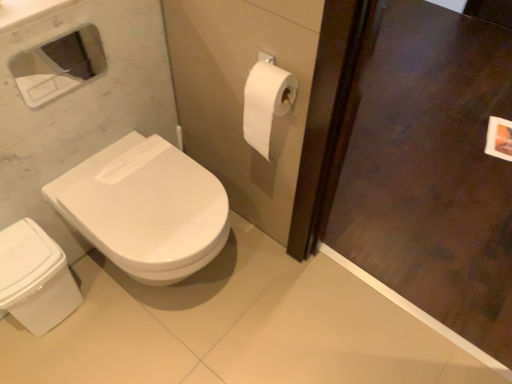
This screenshot has width=512, height=384. I want to click on white glossy medicine cabinet at upper left, so click(58, 66).

Image resolution: width=512 pixels, height=384 pixels. Identify the location of dark wood screen door at right. (432, 170).

Find the location of `white glossy medicine cabinet at upper left`. white glossy medicine cabinet at upper left is located at coordinates (58, 66).

Is dark wood screen door at right at the back of white glossy bidet at lower left?

white glossy bidet at lower left does not have its back to dark wood screen door at right.

At what (x,y) coordinates should I click in order to perform the action: click on screen door that appears on the right of white glossy bidet at lower left. Please return your answer as a coordinate pair (x, y). This screenshot has height=384, width=512. Looking at the image, I should click on (432, 170).

Is white glossy bidet at lower left in front of or behind dark wood screen door at right in the image?

white glossy bidet at lower left is behind dark wood screen door at right.

How much distance is there between dark wood screen door at right and white glossy toilet at lower left?

dark wood screen door at right and white glossy toilet at lower left are 1.06 meters apart from each other.

From a real-world perspective, does dark wood screen door at right sit lower than white glossy toilet at lower left?

Actually, dark wood screen door at right is physically above white glossy toilet at lower left in the real world.

This screenshot has height=384, width=512. Identify the location of screen door that appears on the right of white glossy toilet at lower left. (432, 170).

Considering the points (496, 359) and (95, 181), which point is behind, point (496, 359) or point (95, 181)?

The point (496, 359) is more distant.

Is white glossy medicine cabinet at upper left oriented away from dark wood screen door at right?

No.

Considering the sizes of objects white glossy medicine cabinet at upper left and dark wood screen door at right in the image provided, who is thinner, white glossy medicine cabinet at upper left or dark wood screen door at right?

white glossy medicine cabinet at upper left is thinner.

Is white glossy medicine cabinet at upper left further to the viewer compared to dark wood screen door at right?

Yes, it is.

Which is behind, point (31, 79) or point (7, 287)?

The point (31, 79) is farther.

From a real-world perspective, which is physically above, white glossy medicine cabinet at upper left or white glossy bidet at lower left?

white glossy medicine cabinet at upper left, from a real-world perspective.

Considering the sizes of white glossy medicine cabinet at upper left and white glossy bidet at lower left in the image, is white glossy medicine cabinet at upper left bigger or smaller than white glossy bidet at lower left?

Considering their sizes, white glossy medicine cabinet at upper left takes up less space than white glossy bidet at lower left.

Is white glossy bidet at lower left facing away from white glossy medicine cabinet at upper left?

No.

From their relative heights in the image, would you say white glossy bidet at lower left is taller or shorter than white glossy medicine cabinet at upper left?

Clearly, white glossy bidet at lower left is taller compared to white glossy medicine cabinet at upper left.

What's the angular difference between white glossy bidet at lower left and white glossy medicine cabinet at upper left's facing directions?

0.175 degrees separate the facing orientations of white glossy bidet at lower left and white glossy medicine cabinet at upper left.

Is white glossy toilet at lower left facing towards dark wood screen door at right?

No.

From the image's perspective, which object appears higher, white glossy toilet at lower left or dark wood screen door at right?

dark wood screen door at right, from the image's perspective.

Between white glossy toilet at lower left and dark wood screen door at right, which one has less height?

With less height is white glossy toilet at lower left.

The height and width of the screenshot is (384, 512). In order to click on screen door on the right of white glossy toilet at lower left in this screenshot , I will do `click(432, 170)`.

From a real-world perspective, which object stands above the other?

white glossy toilet at lower left, from a real-world perspective.

In terms of width, does white glossy bidet at lower left look wider or thinner when compared to white glossy toilet at lower left?

Clearly, white glossy bidet at lower left has less width compared to white glossy toilet at lower left.

Consider the image. Which is farther from the camera, (52,260) or (197,182)?

Point (52,260)

Between white glossy bidet at lower left and white glossy toilet at lower left, which one has larger size?

With larger size is white glossy toilet at lower left.

You are a GUI agent. You are given a task and a screenshot of the screen. Output one action in this format:
    pyautogui.click(x=<x>, y=<y>)
    Task: Click on the bidet lying behind the dark wood screen door at right
    This screenshot has width=512, height=384.
    Given the screenshot: What is the action you would take?
    pyautogui.click(x=35, y=278)

At what (x,y) coordinates should I click in order to perform the action: click on toilet on the left of the dark wood screen door at right. Please return your answer as a coordinate pair (x, y). Looking at the image, I should click on (145, 208).

Which object lies nearer to the anchor point white glossy bidet at lower left, dark wood screen door at right or white glossy toilet at lower left?

The object closer to white glossy bidet at lower left is white glossy toilet at lower left.

Looking at the image, which one is located closer to dark wood screen door at right, white glossy toilet at lower left or white glossy medicine cabinet at upper left?

The object closer to dark wood screen door at right is white glossy toilet at lower left.

From the picture: Looking at the image, which one is located closer to white glossy medicine cabinet at upper left, white glossy bidet at lower left or white glossy toilet at lower left?

white glossy toilet at lower left is positioned closer to the anchor white glossy medicine cabinet at upper left.

From the image, which object appears to be nearer to dark wood screen door at right, white glossy toilet at lower left or white glossy bidet at lower left?

The object closer to dark wood screen door at right is white glossy toilet at lower left.

Considering their positions, is dark wood screen door at right positioned further to white glossy bidet at lower left than white glossy medicine cabinet at upper left?

dark wood screen door at right is further to white glossy bidet at lower left.

Considering their positions, is white glossy medicine cabinet at upper left positioned closer to white glossy toilet at lower left than dark wood screen door at right?

dark wood screen door at right.

Looking at the image, which one is located further to dark wood screen door at right, white glossy bidet at lower left or white glossy toilet at lower left?

Based on the image, white glossy bidet at lower left appears to be further to dark wood screen door at right.

Estimate the real-world distances between objects in this image. Which object is closer to dark wood screen door at right, white glossy medicine cabinet at upper left or white glossy bidet at lower left?

white glossy bidet at lower left lies closer to dark wood screen door at right than the other object.

This screenshot has height=384, width=512. Find the location of `toilet between white glossy medicine cabinet at upper left and white glossy bidet at lower left in the up-down direction`. toilet between white glossy medicine cabinet at upper left and white glossy bidet at lower left in the up-down direction is located at coordinates (145, 208).

Find the location of a particular element. Image resolution: width=512 pixels, height=384 pixels. toilet between white glossy bidet at lower left and dark wood screen door at right is located at coordinates (145, 208).

The image size is (512, 384). In order to click on medicine cabinet between white glossy bidet at lower left and dark wood screen door at right in the horizontal direction in this screenshot , I will do `click(58, 66)`.

Locate an element on the screen. The height and width of the screenshot is (384, 512). toilet between white glossy medicine cabinet at upper left and dark wood screen door at right is located at coordinates (145, 208).